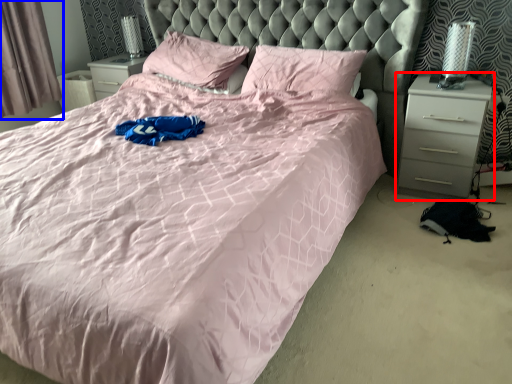
Question: Among these objects, which one is farthest to the camera, nightstand (highlighted by a red box) or curtain (highlighted by a blue box)?

Choices:
 (A) nightstand
 (B) curtain

Answer: (B)